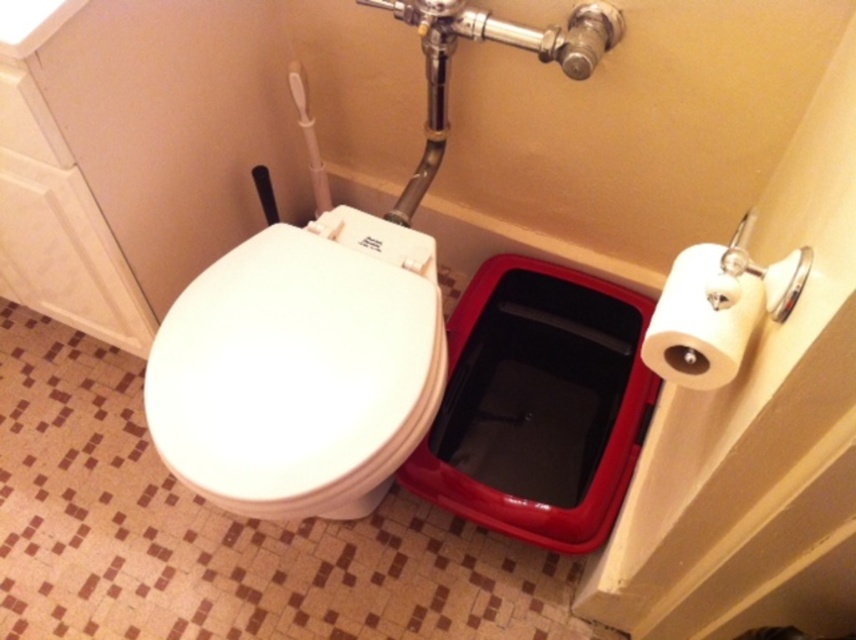
Question: Is white glossy toilet seat at center above white matte toilet paper at right?

Choices:
 (A) yes
 (B) no

Answer: (B)

Question: Which point is farther to the camera?

Choices:
 (A) white matte toilet paper at right
 (B) white glossy toilet seat at center

Answer: (B)

Question: Is white glossy toilet seat at center positioned behind white matte toilet paper at right?

Choices:
 (A) no
 (B) yes

Answer: (B)

Question: Which point appears farthest from the camera in this image?

Choices:
 (A) (337, 422)
 (B) (678, 378)

Answer: (A)

Question: Is white glossy toilet seat at center above white matte toilet paper at right?

Choices:
 (A) no
 (B) yes

Answer: (A)